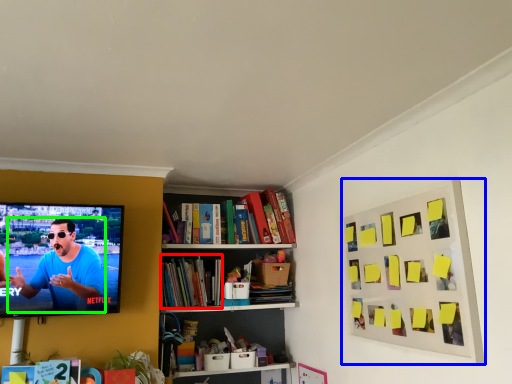
Question: Based on their relative distances, which object is farther from book (highlighted by a red box)? Choose from picture frame (highlighted by a blue box) and person (highlighted by a green box).

Choices:
 (A) picture frame
 (B) person

Answer: (A)